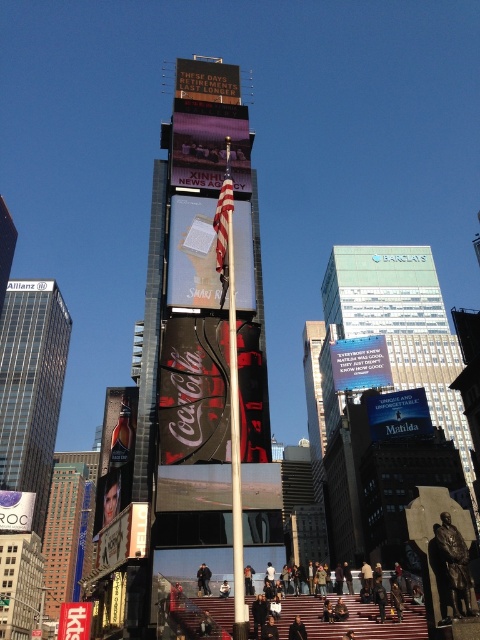
You are a window cleaner who needs to clean both the matte purple screen at center and the shiny gold bottle at center. Which object will require you to use a longer ladder?

The matte purple screen at center is much taller than the shiny gold bottle at center, so you will need a longer ladder to clean the matte purple screen at center.

You are standing in Times Square and want to take a photo of both the matte purple screen at center and the red brick stairs at center. Which object should you focus on first to ensure both are in the frame?

You should focus on the matte purple screen at center first because it is closer to you than the red brick stairs at center, so adjusting the camera to include both would require ensuring the foreground and background are in focus.

What object is located at the coordinates point (210, 145) in the image?

The point (210, 145) is on the matte purple screen at center.